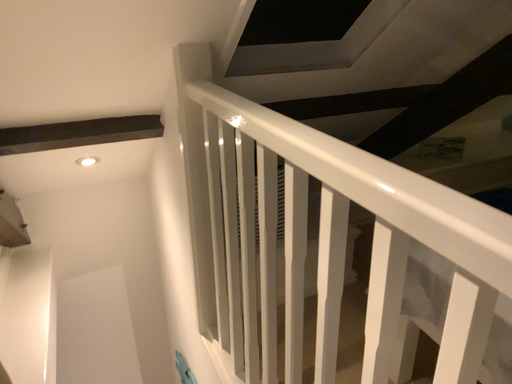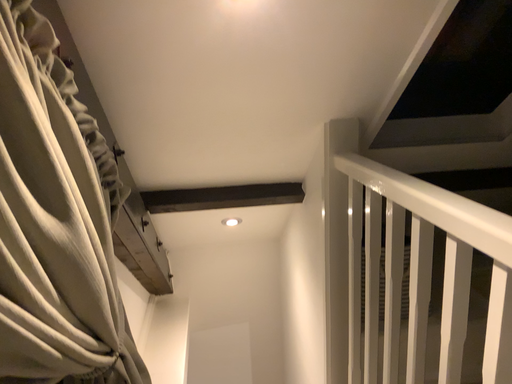
Question: Which way did the camera rotate in the video?

Choices:
 (A) rotated left
 (B) rotated right

Answer: (A)